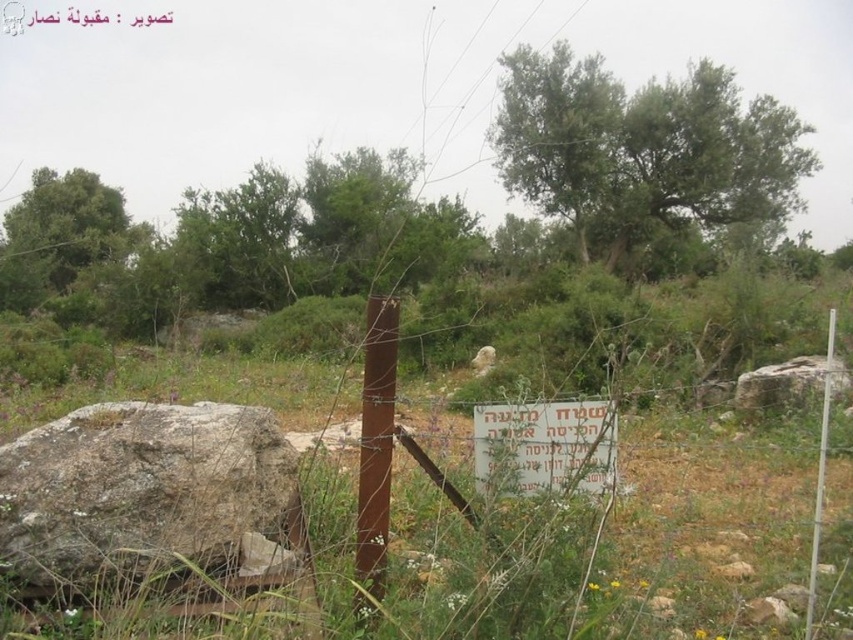
Question: Which object is positioned closest to the white plastic sign at center?

Choices:
 (A) green leafy tree at upper right
 (B) rusty metal pole at center

Answer: (B)

Question: Which of the following is the farthest from the observer?

Choices:
 (A) green leafy tree at upper right
 (B) green leafy tree at upper left
 (C) gray rough rock at lower left
 (D) white plastic sign at center

Answer: (B)

Question: Can you confirm if smooth gray rock at center is thinner than white plastic pole at right?

Choices:
 (A) no
 (B) yes

Answer: (B)

Question: Is gray rough rock at lower left thinner than smooth gray rock at center?

Choices:
 (A) yes
 (B) no

Answer: (A)

Question: Which point is closer to the camera?

Choices:
 (A) smooth gray rock at center
 (B) green leafy tree at upper right

Answer: (A)

Question: From the image, what is the correct spatial relationship of white plastic sign at center in relation to smooth gray rock at center?

Choices:
 (A) left
 (B) right

Answer: (A)